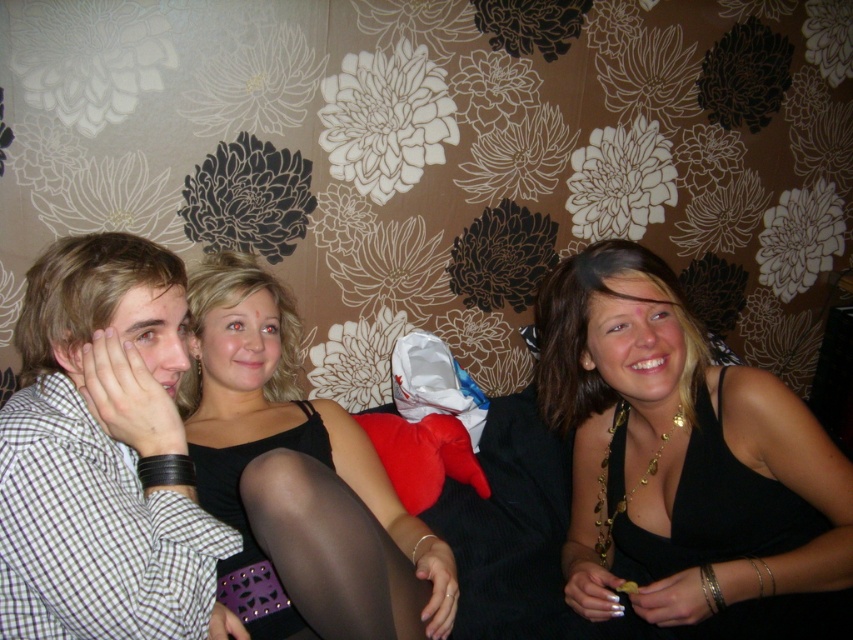
In the scene shown: You are standing in front of the image and want to locate the checkered fabric shirt at left. According to the coordinates given, where is it positioned?

The checkered fabric shirt at left is positioned at point 0.719 on the x axis and 0.116 on the y axis.

You are a fashion designer observing the image of three people sitting on a floral wallpaper background. You notice the black satin tank top at center and the black satin dress at center. Which clothing item is visible on top?

The black satin tank top at center is positioned over the black satin dress at center, making it the visible top layer.